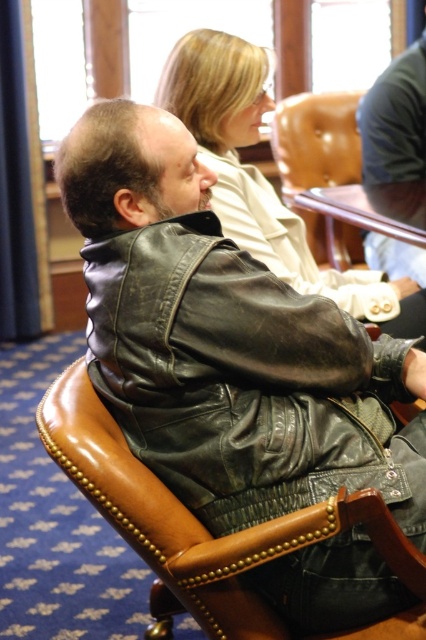
Is point (94, 193) positioned in front of point (362, 326)?

Yes, it is.

Does leather jacket at center appear on the left side of brown leather jacket at center?

Incorrect, leather jacket at center is not on the left side of brown leather jacket at center.

You are a GUI agent. You are given a task and a screenshot of the screen. Output one action in this format:
    pyautogui.click(x=<x>, y=<y>)
    Task: Click on the leather jacket at center
    The height and width of the screenshot is (640, 426).
    Given the screenshot: What is the action you would take?
    tap(224, 342)

Between brown leather jacket at center and light beige leather jacket at upper center, which one is positioned lower?

brown leather jacket at center is lower down.

Measure the distance between brown leather jacket at center and light beige leather jacket at upper center.

76.56 centimeters

At what (x,y) coordinates should I click in order to perform the action: click on brown leather jacket at center. Please return your answer as a coordinate pair (x, y). The width and height of the screenshot is (426, 640). Looking at the image, I should click on (236, 374).

From the picture: Does brown leather jacket at center have a greater width compared to dark brown leather jacket at center?

Yes.

Does brown leather jacket at center appear under dark brown leather jacket at center?

Yes.

Which is behind, point (359, 333) or point (379, 157)?

The point (379, 157) is more distant.

Identify the location of brown leather jacket at center. (236, 374).